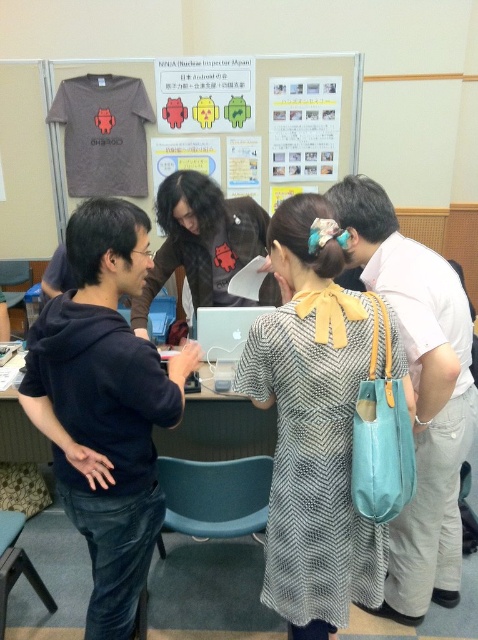
You are organizing a small exhibition and need to arrange the patterned fabric dress at center and the matte plastic android figures at upper center on a shelf. Given that the shelf has limited space, which item should you place first to ensure both fit properly?

The patterned fabric dress at center has a lesser width compared to the matte plastic android figures at upper center. Therefore, you should place the matte plastic android figures at upper center first to accommodate their larger size, then fit the narrower patterned fabric dress at center alongside them.

You are organizing a small workshop and need to ensure there is enough space on the table for both the matte black shirt at center and the white paper at upper center. Based on their sizes, can both items fit side by side on a standard 1.2 meter wide table?

The matte black shirt at center might be wider than white paper at upper center, but without exact measurements, it is uncertain if both can fit side by side on a 1.2 meter wide table. Additional information about their widths is needed to determine this.

You are standing at the entrance of the room and want to approach the person in the matte black shirt at center. Which direction should you move to reach them?

Since the matte black shirt at center is positioned at point (204, 244), you should move towards the center of the room to reach them.